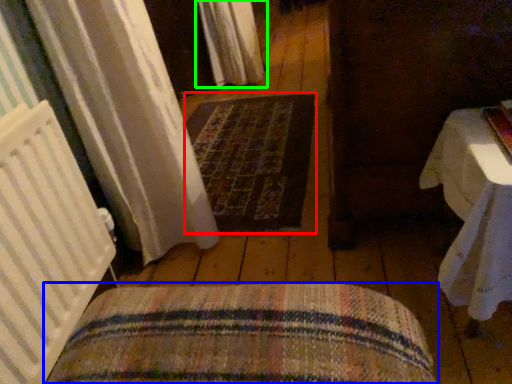
Question: Which object is the closest to the mat (highlighted by a red box)? Choose among these: furniture (highlighted by a blue box) or curtain (highlighted by a green box).

Choices:
 (A) furniture
 (B) curtain

Answer: (B)